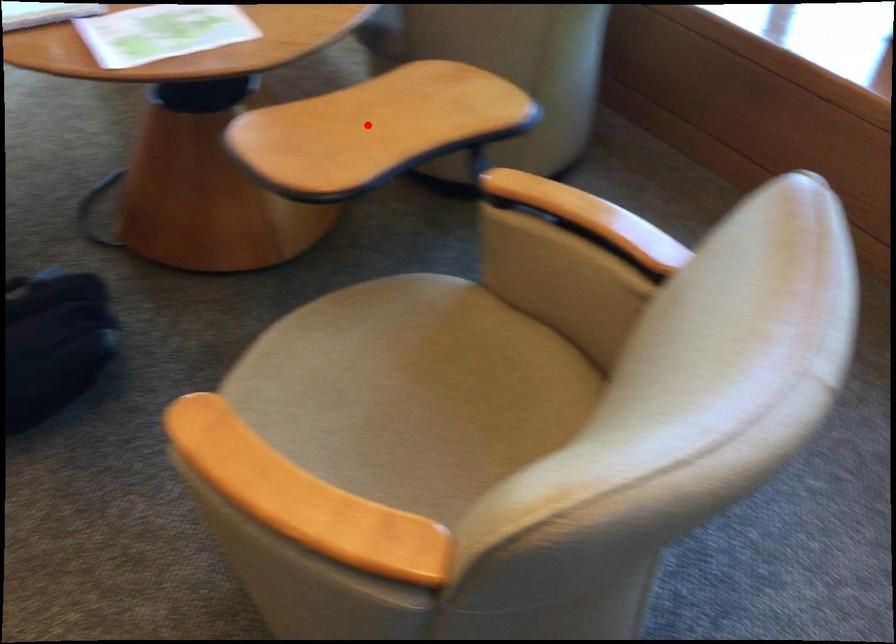
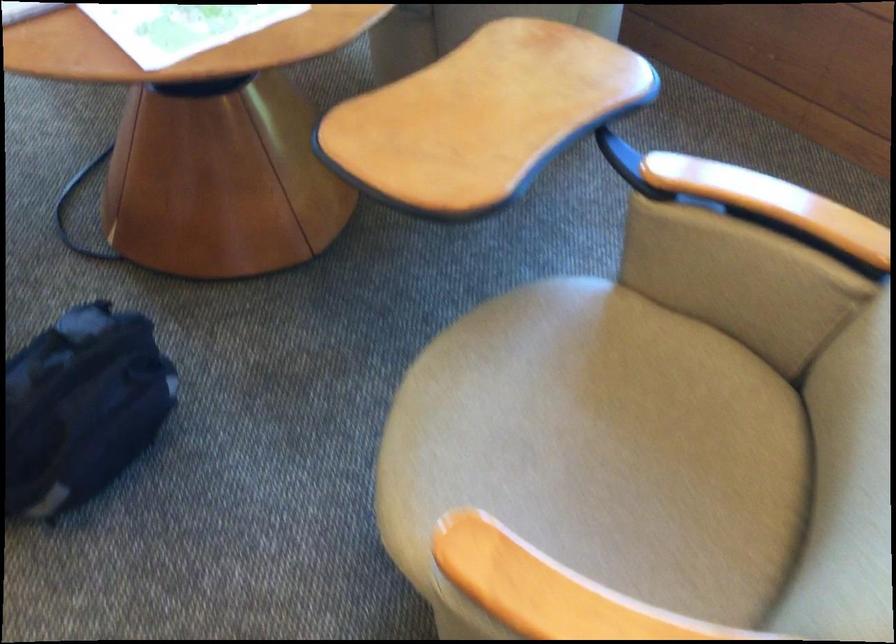
Find the pixel in the second image that matches the highlighted location in the first image.

(483, 116)